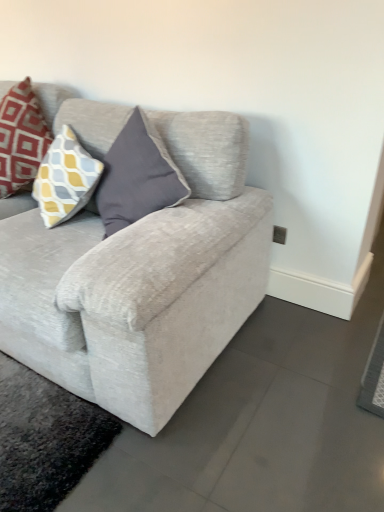
Question: Is matte red pillow at upper left bigger or smaller than light gray fabric couch at center?

Choices:
 (A) big
 (B) small

Answer: (B)

Question: From a real-world perspective, is matte red pillow at upper left above or below light gray fabric couch at center?

Choices:
 (A) below
 (B) above

Answer: (B)

Question: Choose the correct answer: Is matte red pillow at upper left inside light gray fabric couch at center or outside it?

Choices:
 (A) outside
 (B) inside

Answer: (B)

Question: From the image's perspective, is light gray fabric couch at center positioned above or below matte red pillow at upper left?

Choices:
 (A) below
 (B) above

Answer: (A)

Question: Considering the positions of light gray fabric couch at center and matte red pillow at upper left in the image, is light gray fabric couch at center taller or shorter than matte red pillow at upper left?

Choices:
 (A) tall
 (B) short

Answer: (A)

Question: Relative to matte red pillow at upper left, is light gray fabric couch at center in front or behind?

Choices:
 (A) front
 (B) behind

Answer: (A)

Question: Is light gray fabric couch at center bigger or smaller than matte red pillow at upper left?

Choices:
 (A) small
 (B) big

Answer: (B)